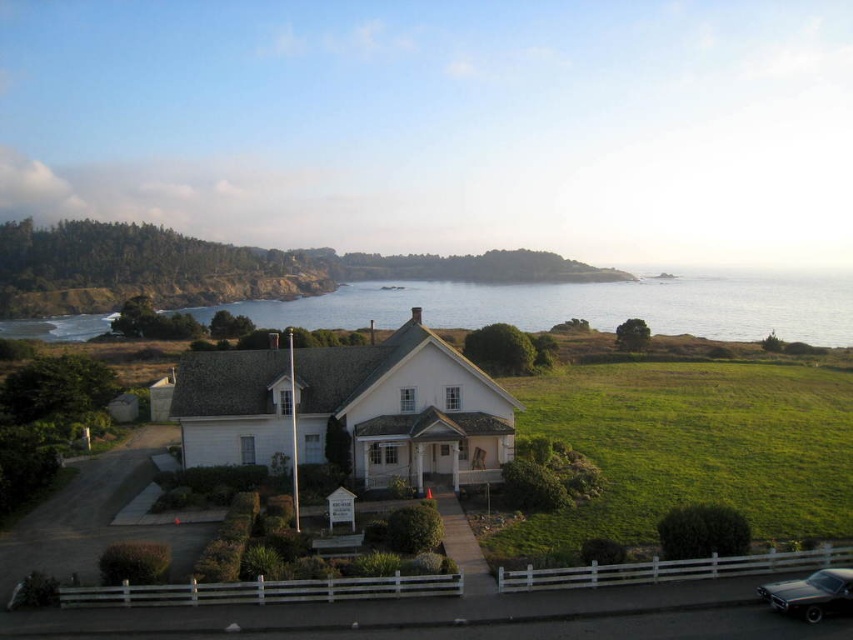
Question: Is white wood fence at center below shiny black car at lower right?

Choices:
 (A) no
 (B) yes

Answer: (A)

Question: Is white wood fence at center smaller than shiny black car at lower right?

Choices:
 (A) yes
 (B) no

Answer: (B)

Question: Is white wood fence at center above blue water at center?

Choices:
 (A) yes
 (B) no

Answer: (B)

Question: Estimate the real-world distances between objects in this image. Which object is closer to the shiny black car at lower right?

Choices:
 (A) blue water at center
 (B) white wood fence at center

Answer: (B)

Question: Based on their relative distances, which object is farther from the white wood fence at center?

Choices:
 (A) blue water at center
 (B) shiny black car at lower right

Answer: (A)

Question: Which of the following is the farthest from the observer?

Choices:
 (A) blue water at center
 (B) shiny black car at lower right
 (C) white wood fence at center

Answer: (A)